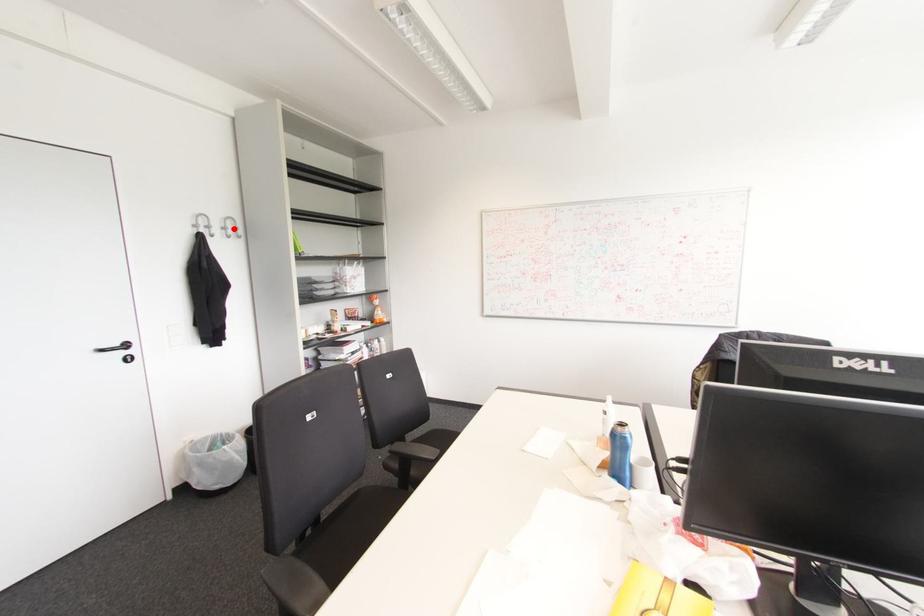
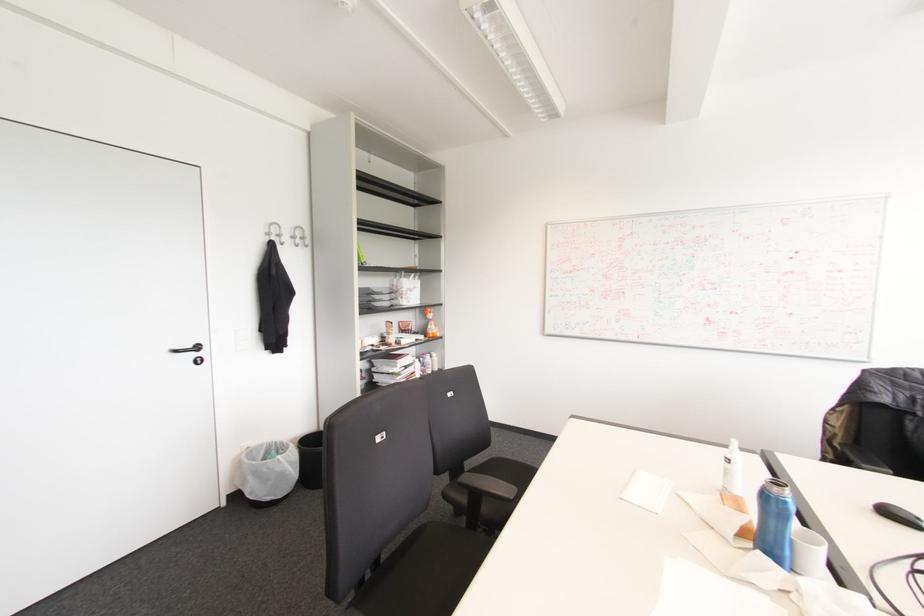
Find the pixel in the second image that matches the highlighted location in the first image.

(301, 238)